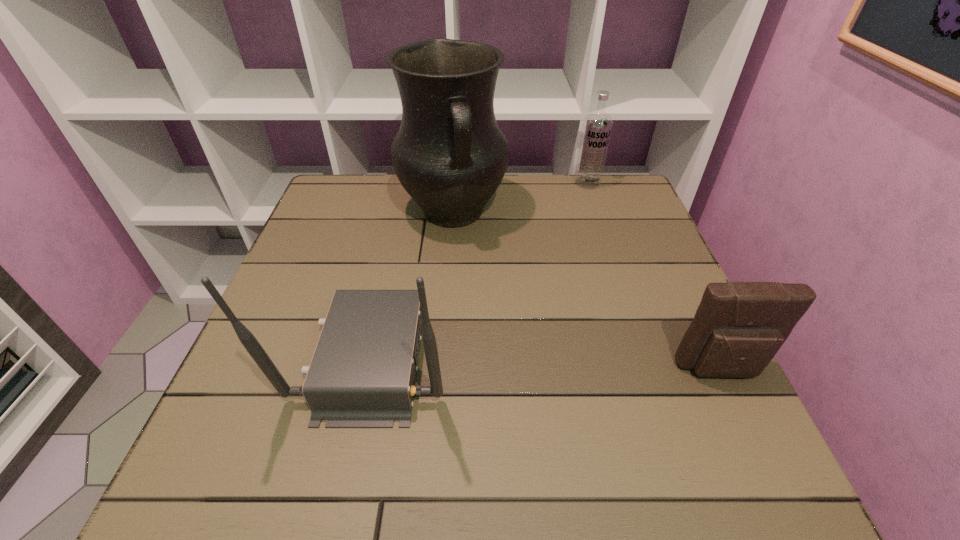
This screenshot has height=540, width=960. In order to click on vacant space that is in between the rightmost object and the router in this screenshot , I will do `click(548, 364)`.

What are the coordinates of `unoccupied area between the tallest object and the third object from left to right` in the screenshot? It's located at (520, 198).

Locate an element on the screen. This screenshot has width=960, height=540. free space between the tallest object and the shortest object is located at coordinates (588, 292).

At what (x,y) coordinates should I click in order to perform the action: click on free space between the pitcher and the router. Please return your answer as a coordinate pair (x, y). The height and width of the screenshot is (540, 960). Looking at the image, I should click on (414, 285).

Find the location of a particular element. Image resolution: width=960 pixels, height=540 pixels. vacant space in between the pitcher and the second shortest object is located at coordinates (520, 198).

The height and width of the screenshot is (540, 960). Find the location of `free spot between the rightmost object and the vodka`. free spot between the rightmost object and the vodka is located at coordinates (655, 276).

Identify the location of object that is the nearest to the third object from left to right. This screenshot has width=960, height=540. (449, 154).

The height and width of the screenshot is (540, 960). Identify the location of object that can be found as the third closest to the shortest object. (597, 126).